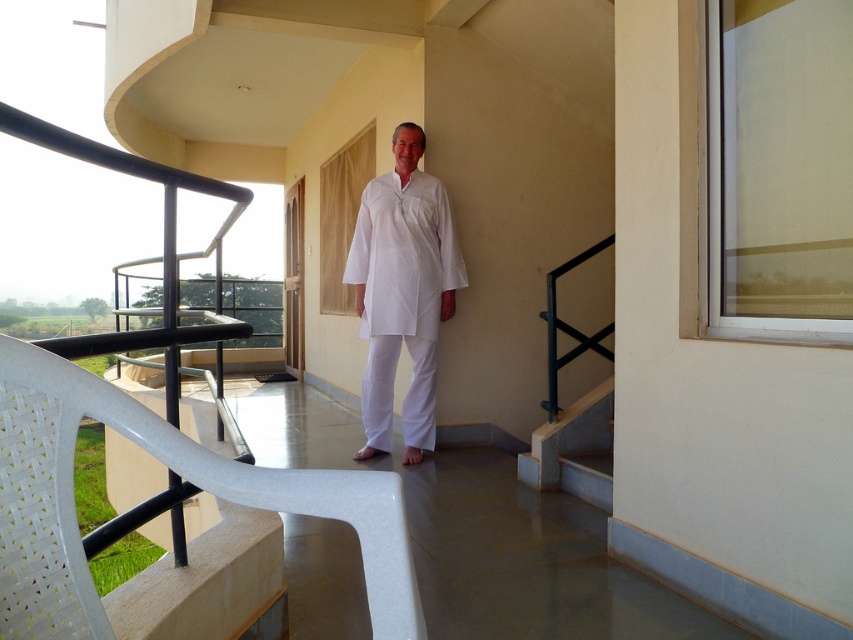
Between white cotton kurta at center and concrete/stained at lower right, which one has more height?

white cotton kurta at center is taller.

Consider the image. Is white cotton kurta at center further to the viewer compared to concrete/stained at lower right?

Yes, it is behind concrete/stained at lower right.

The width and height of the screenshot is (853, 640). What are the coordinates of `white cotton kurta at center` in the screenshot? It's located at (402, 291).